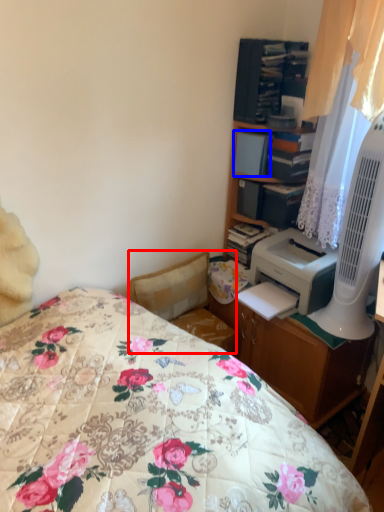
Question: Which point is further to the camera, swivel chair (highlighted by a red box) or book (highlighted by a blue box)?

Choices:
 (A) swivel chair
 (B) book

Answer: (B)